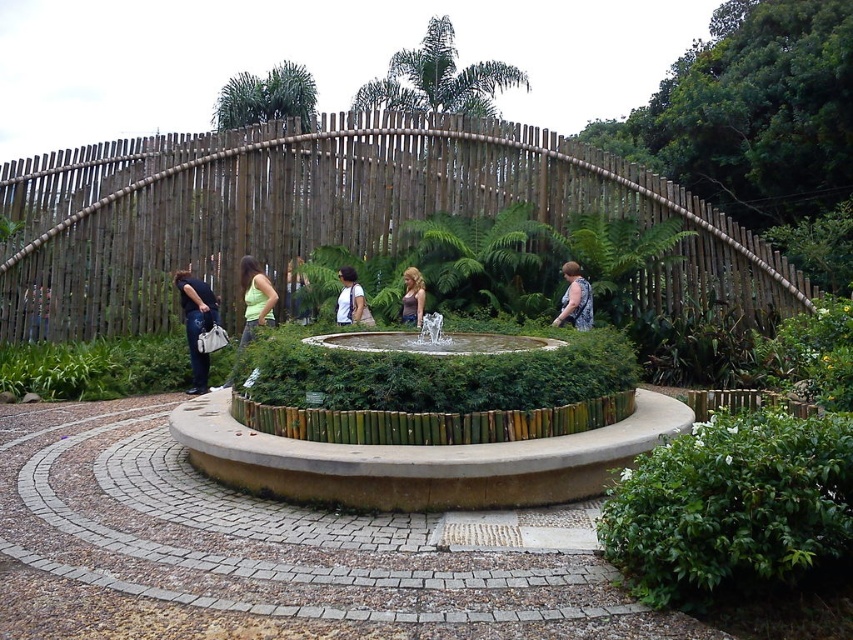
Between green matte tank top at center and matte white shirt at center, which one appears on the right side from the viewer's perspective?

matte white shirt at center is more to the right.

Does green matte tank top at center have a lesser width compared to matte white shirt at center?

No.

This screenshot has height=640, width=853. In order to click on green matte tank top at center in this screenshot , I will do `click(254, 298)`.

Which of these two, green matte tank top at center or matte purple tank top at center, stands taller?

green matte tank top at center

Is green matte tank top at center thinner than matte purple tank top at center?

No, green matte tank top at center is not thinner than matte purple tank top at center.

Is point (260, 317) more distant than point (416, 312)?

No, it is in front of (416, 312).

I want to click on green matte tank top at center, so click(254, 298).

Is matte black shirt at left closer to the viewer compared to matte white shirt at center?

No.

Who is more distant from viewer, (184, 285) or (341, 314)?

The point (341, 314) is behind.

Which is behind, point (190, 349) or point (341, 276)?

The point (341, 276) is behind.

At what (x,y) coordinates should I click in order to perform the action: click on matte black shirt at left. Please return your answer as a coordinate pair (x, y). Looking at the image, I should click on (196, 323).